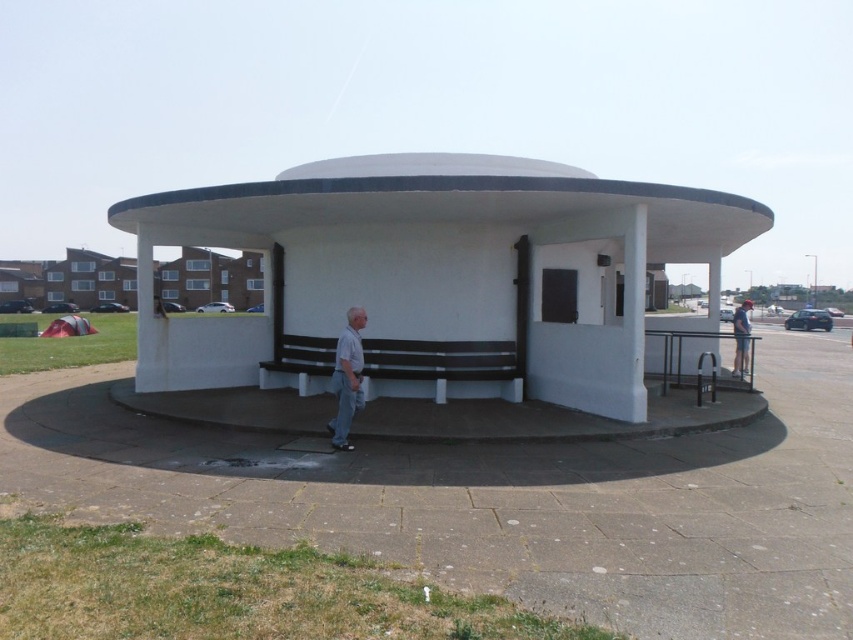
Question: Is light gray fabric pants at center bigger than light blue denim jeans at center?

Choices:
 (A) no
 (B) yes

Answer: (A)

Question: Observing the image, what is the correct spatial positioning of light gray fabric pants at center in reference to light blue denim jeans at center?

Choices:
 (A) left
 (B) right

Answer: (A)

Question: Among these points, which one is farthest from the camera?

Choices:
 (A) (352, 317)
 (B) (740, 355)

Answer: (B)

Question: Which point is closer to the camera?

Choices:
 (A) light blue denim jeans at center
 (B) white matte gazebo at center
 (C) light gray fabric pants at center

Answer: (C)

Question: Which of the following is the farthest from the observer?

Choices:
 (A) (740, 369)
 (B) (160, 228)
 (C) (343, 378)

Answer: (A)

Question: Is light gray fabric pants at center closer to camera compared to light blue denim jeans at center?

Choices:
 (A) yes
 (B) no

Answer: (A)